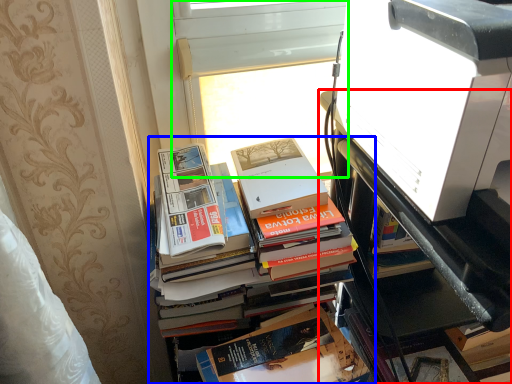
Question: Considering the real-world distances, which object is closest to bookcase (highlighted by a red box)? book (highlighted by a blue box) or window screen (highlighted by a green box).

Choices:
 (A) book
 (B) window screen

Answer: (A)